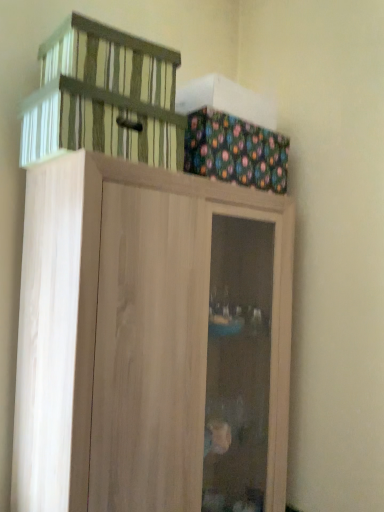
Locate an element on the screen. striped fabric basket at upper left is located at coordinates (103, 97).

Measure the distance between point (241, 215) and camera.

Point (241, 215) is 4.75 feet away from camera.

Describe the element at coordinates (235, 151) in the screenshot. I see `multicolored fabric box at upper right` at that location.

Where is `striped fabric basket at upper left`? This screenshot has height=512, width=384. striped fabric basket at upper left is located at coordinates (103, 97).

Is light wood cupboard at upper center bigger than multicolored fabric box at upper right?

Indeed, light wood cupboard at upper center has a larger size compared to multicolored fabric box at upper right.

From the image's perspective, who appears lower, light wood cupboard at upper center or multicolored fabric box at upper right?

From the image's view, light wood cupboard at upper center is below.

Choose the correct answer: Is light wood cupboard at upper center inside multicolored fabric box at upper right or outside it?

light wood cupboard at upper center is spatially situated outside multicolored fabric box at upper right.

Find the location of a particular element. This screenshot has height=512, width=384. cupboard on the left of multicolored fabric box at upper right is located at coordinates (151, 341).

Is striped fabric basket at upper left at the right side of light wood cupboard at upper center?

Incorrect, striped fabric basket at upper left is not on the right side of light wood cupboard at upper center.

You are a GUI agent. You are given a task and a screenshot of the screen. Output one action in this format:
    pyautogui.click(x=<x>, y=<y>)
    Task: Click on the cupboard that appears on the right of striped fabric basket at upper left
    This screenshot has width=384, height=512.
    Given the screenshot: What is the action you would take?
    pyautogui.click(x=151, y=341)

Is striped fabric basket at upper left bigger or smaller than light wood cupboard at upper center?

striped fabric basket at upper left is smaller than light wood cupboard at upper center.

Is light wood cupboard at upper center wider than striped fabric basket at upper left?

Yes.

Is light wood cupboard at upper center turned away from striped fabric basket at upper left?

No, light wood cupboard at upper center is not facing the opposite direction of striped fabric basket at upper left.

Is light wood cupboard at upper center bigger or smaller than striped fabric basket at upper left?

light wood cupboard at upper center is bigger than striped fabric basket at upper left.

Which of these two, multicolored fabric box at upper right or light wood cupboard at upper center, is thinner?

multicolored fabric box at upper right.

Could you tell me if multicolored fabric box at upper right is facing light wood cupboard at upper center?

No, multicolored fabric box at upper right is not facing towards light wood cupboard at upper center.

Between striped fabric basket at upper left and multicolored fabric box at upper right, which one appears on the left side from the viewer's perspective?

Positioned to the left is striped fabric basket at upper left.

Between striped fabric basket at upper left and multicolored fabric box at upper right, which one has more height?

With more height is multicolored fabric box at upper right.

Considering the sizes of objects striped fabric basket at upper left and multicolored fabric box at upper right in the image provided, who is thinner, striped fabric basket at upper left or multicolored fabric box at upper right?

Thinner between the two is multicolored fabric box at upper right.

Is there a large distance between striped fabric basket at upper left and multicolored fabric box at upper right?

No, striped fabric basket at upper left is not far from multicolored fabric box at upper right.

From the image's perspective, is multicolored fabric box at upper right above or below striped fabric basket at upper left?

Clearly, from the image's perspective, multicolored fabric box at upper right is below striped fabric basket at upper left.

From the picture: Considering the sizes of objects multicolored fabric box at upper right and striped fabric basket at upper left in the image provided, who is smaller, multicolored fabric box at upper right or striped fabric basket at upper left?

striped fabric basket at upper left.

Can you tell me how much multicolored fabric box at upper right and striped fabric basket at upper left differ in facing direction?

The angle between the facing direction of multicolored fabric box at upper right and the facing direction of striped fabric basket at upper left is 4.96 degrees.

Are multicolored fabric box at upper right and striped fabric basket at upper left making contact?

No, multicolored fabric box at upper right is not in contact with striped fabric basket at upper left.

Locate an element on the screen. Image resolution: width=384 pixels, height=512 pixels. cupboard below the multicolored fabric box at upper right (from a real-world perspective) is located at coordinates (151, 341).

Find the location of `basket above the light wood cupboard at upper center (from a real-world perspective)`. basket above the light wood cupboard at upper center (from a real-world perspective) is located at coordinates (103, 97).

Which object lies further to the anchor point striped fabric basket at upper left, multicolored fabric box at upper right or light wood cupboard at upper center?

Among the two, light wood cupboard at upper center is located further to striped fabric basket at upper left.

Based on their spatial positions, is light wood cupboard at upper center or multicolored fabric box at upper right closer to striped fabric basket at upper left?

multicolored fabric box at upper right lies closer to striped fabric basket at upper left than the other object.

From the image, which object appears to be nearer to light wood cupboard at upper center, multicolored fabric box at upper right or striped fabric basket at upper left?

striped fabric basket at upper left is closer to light wood cupboard at upper center.

From the picture: Considering their positions, is striped fabric basket at upper left positioned closer to light wood cupboard at upper center than multicolored fabric box at upper right?

striped fabric basket at upper left is closer to light wood cupboard at upper center.

Considering their positions, is light wood cupboard at upper center positioned further to multicolored fabric box at upper right than striped fabric basket at upper left?

light wood cupboard at upper center.

Considering their positions, is striped fabric basket at upper left positioned further to multicolored fabric box at upper right than light wood cupboard at upper center?

Based on the image, light wood cupboard at upper center appears to be further to multicolored fabric box at upper right.

You are a GUI agent. You are given a task and a screenshot of the screen. Output one action in this format:
    pyautogui.click(x=<x>, y=<y>)
    Task: Click on the cabinetry between striped fabric basket at upper left and light wood cupboard at upper center in the up-down direction
    This screenshot has height=512, width=384.
    Given the screenshot: What is the action you would take?
    pyautogui.click(x=235, y=151)